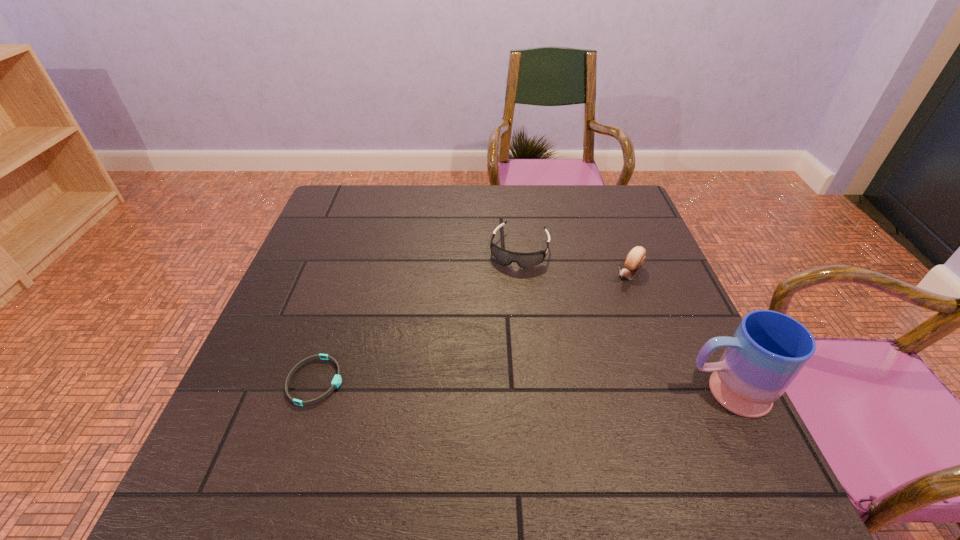
This screenshot has height=540, width=960. Find the location of `free space on the desktop that is between the shortest object and the mug and is positioned on the front-facing side of the escargot`. free space on the desktop that is between the shortest object and the mug and is positioned on the front-facing side of the escargot is located at coordinates (521, 387).

Identify the location of vacant space on the desktop that is between the wristband and the mug and is positioned on the front and sides of the third tallest object. (478, 386).